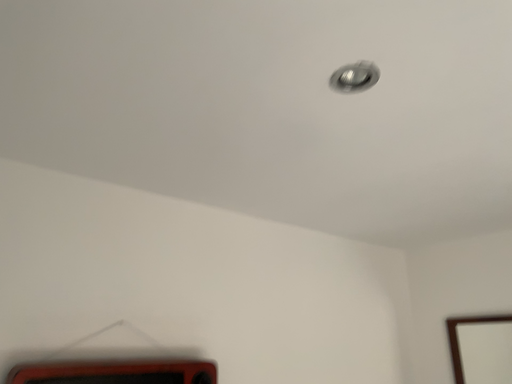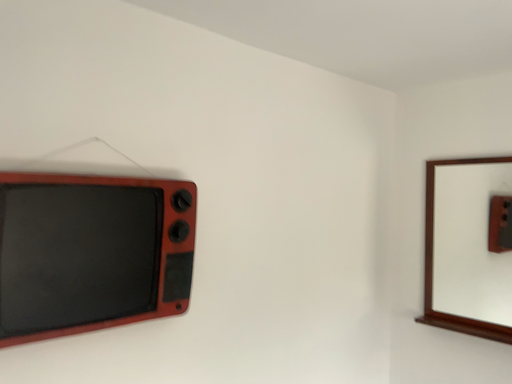
Question: How did the camera likely rotate when shooting the video?

Choices:
 (A) rotated upward
 (B) rotated downward

Answer: (B)